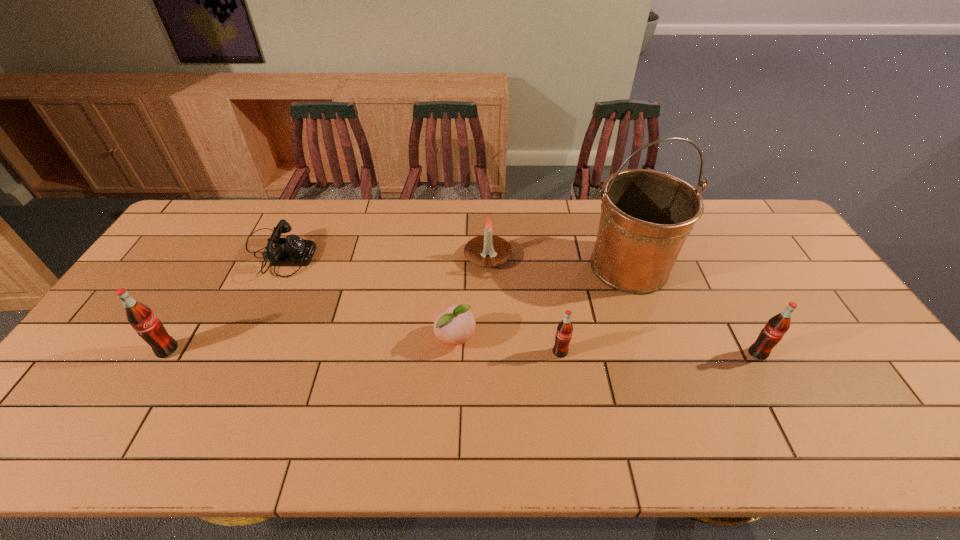
In order to click on telephone that is at the far edge in this screenshot , I will do `click(291, 251)`.

The image size is (960, 540). I want to click on bucket at the far edge, so click(646, 216).

Locate an element on the screen. The image size is (960, 540). candle present at the far edge is located at coordinates (487, 250).

The image size is (960, 540). In order to click on free space at the far edge of the desktop in this screenshot , I will do `click(443, 211)`.

Identify the location of vacant area at the near edge of the desktop. (352, 397).

In the image, there is a desktop. Identify the location of vacant space at the left edge. This screenshot has height=540, width=960. (112, 336).

Locate an element on the screen. vacant area between the leftmost object and the candle is located at coordinates (328, 303).

At what (x,y) coordinates should I click in order to perform the action: click on free area in between the leftmost soda bottle and the second shortest object. Please return your answer as a coordinate pair (x, y). Looking at the image, I should click on (312, 345).

Image resolution: width=960 pixels, height=540 pixels. What are the coordinates of `empty space that is in between the shortest soda bottle and the leftmost soda bottle` in the screenshot? It's located at (364, 352).

Identify the location of vacant space in between the telephone and the leftmost object. The width and height of the screenshot is (960, 540). (223, 302).